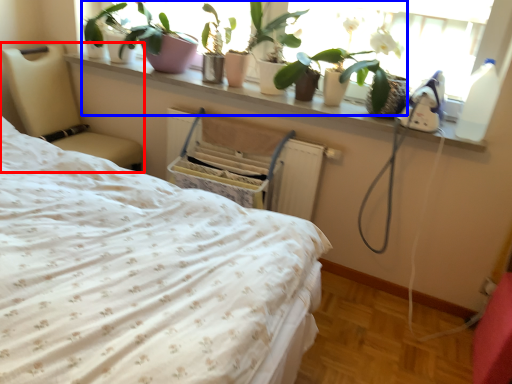
Question: Which of the following is the closest to the observer, furniture (highlighted by a red box) or plant (highlighted by a blue box)?

Choices:
 (A) furniture
 (B) plant

Answer: (B)